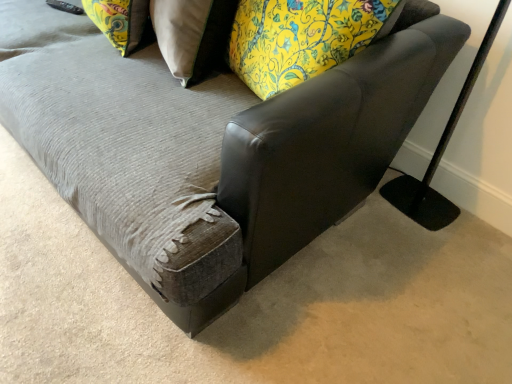
Question: Should I look upward or downward to see black matte table lamp at right?

Choices:
 (A) down
 (B) up

Answer: (B)

Question: From the image's perspective, is leather swivel chair at center on top of floral fabric pillow at upper center, the 1th pillow when ordered from right to left?

Choices:
 (A) no
 (B) yes

Answer: (A)

Question: Is leather swivel chair at center shorter than floral fabric pillow at upper center, placed as the 2th pillow when sorted from left to right?

Choices:
 (A) yes
 (B) no

Answer: (B)

Question: From a real-world perspective, is leather swivel chair at center on top of floral fabric pillow at upper center, the 1th pillow when ordered from right to left?

Choices:
 (A) yes
 (B) no

Answer: (A)

Question: Does leather swivel chair at center have a larger size compared to floral fabric pillow at upper center, placed as the 2th pillow when sorted from left to right?

Choices:
 (A) yes
 (B) no

Answer: (A)

Question: Could you tell me if leather swivel chair at center is facing floral fabric pillow at upper center, the 1th pillow when ordered from right to left?

Choices:
 (A) no
 (B) yes

Answer: (A)

Question: Is leather swivel chair at center closer to camera compared to floral fabric pillow at upper center, placed as the 2th pillow when sorted from left to right?

Choices:
 (A) yes
 (B) no

Answer: (A)

Question: From a real-world perspective, is floral fabric pillow at upper left, the second pillow viewed from the right, positioned under floral fabric pillow at upper center, placed as the 2th pillow when sorted from left to right, based on gravity?

Choices:
 (A) no
 (B) yes

Answer: (A)

Question: Is floral fabric pillow at upper center, placed as the 2th pillow when sorted from left to right, at the back of floral fabric pillow at upper left, the second pillow viewed from the right?

Choices:
 (A) yes
 (B) no

Answer: (A)

Question: Is floral fabric pillow at upper left, which is the 1th pillow from left to right, taller than floral fabric pillow at upper center, the 1th pillow when ordered from right to left?

Choices:
 (A) yes
 (B) no

Answer: (B)

Question: Is floral fabric pillow at upper left, which is the 1th pillow from left to right, surrounding floral fabric pillow at upper center, the 1th pillow when ordered from right to left?

Choices:
 (A) yes
 (B) no

Answer: (B)

Question: Can you confirm if floral fabric pillow at upper left, the second pillow viewed from the right, is positioned to the right of floral fabric pillow at upper center, placed as the 2th pillow when sorted from left to right?

Choices:
 (A) no
 (B) yes

Answer: (A)

Question: Considering the relative positions of floral fabric pillow at upper left, which is the 1th pillow from left to right, and floral fabric pillow at upper center, the 1th pillow when ordered from right to left, in the image provided, is floral fabric pillow at upper left, which is the 1th pillow from left to right, in front of floral fabric pillow at upper center, the 1th pillow when ordered from right to left,?

Choices:
 (A) yes
 (B) no

Answer: (B)

Question: Is floral fabric pillow at upper left, which is the 1th pillow from left to right, in front of black matte table lamp at right?

Choices:
 (A) no
 (B) yes

Answer: (A)